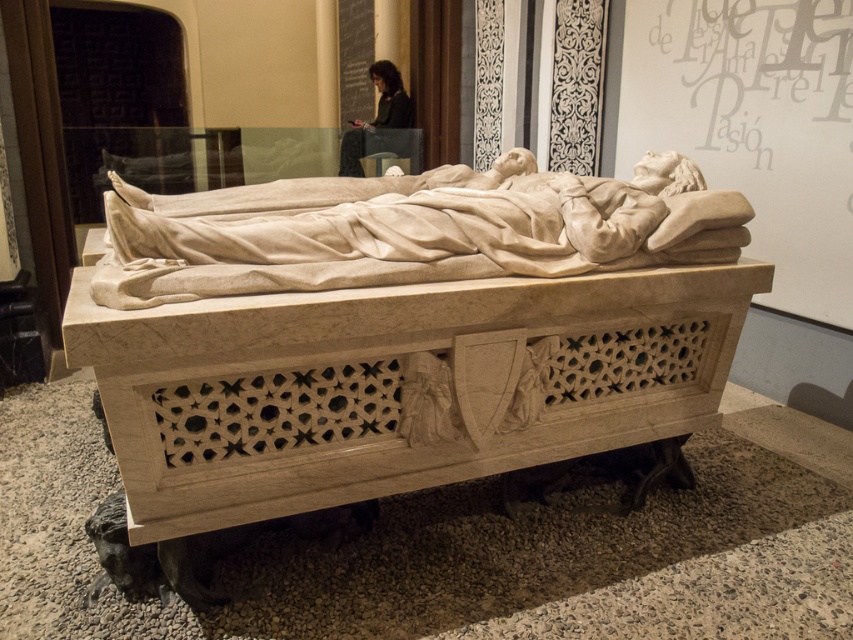
You are an art conservator examining the marble sarcophagus in the museum. You need to determine if the dark hair person at upper center can be placed on the white marble bed at center without exceeding its height. Can you confirm?

The white marble bed at center has a greater height compared to the dark hair person at upper center, so the person can be placed on the bed without exceeding its height.

You are an archaeologist examining the marble sarcophagus in the museum. You notice two points marked on the sarcophagus. The first point is at coordinate point (223, 426) and the second is at point (354, 163). From your vantage point, which of these two points is nearer to you?

Point (223, 426) is closer to the camera than point (354, 163), so the first point is nearer to you.

You are an art conservator tasked with moving the white marble statue at center and the dark hair person at upper center to a new exhibition space. The transport crate can only accommodate items up to 1.2 meters in width. Based on the provided information, can both items be safely placed in the same crate without exceeding the width limit?

The white marble statue at center might be wider than dark hair person at upper center, but since the exact width of both items isn not specified, it is uncertain whether their combined width would exceed the 1.2 meter limit. Further measurements are needed to ensure safe transport.